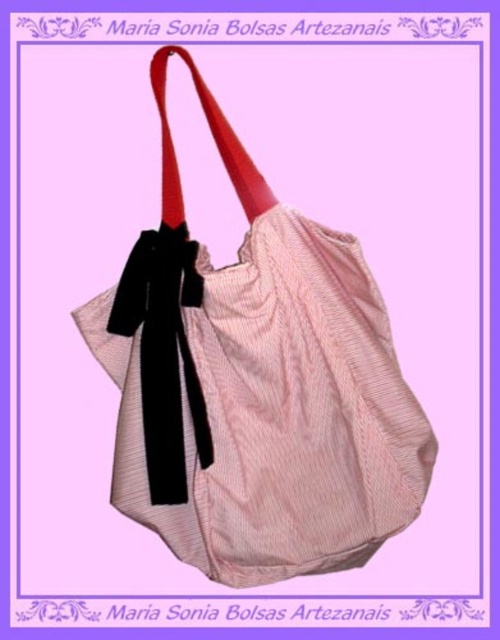
Can you confirm if pink striped fabric shoulder bag at center is shorter than black velvet tie at center?

In fact, pink striped fabric shoulder bag at center may be taller than black velvet tie at center.

Identify the location of pink striped fabric shoulder bag at center. The height and width of the screenshot is (640, 500). (256, 385).